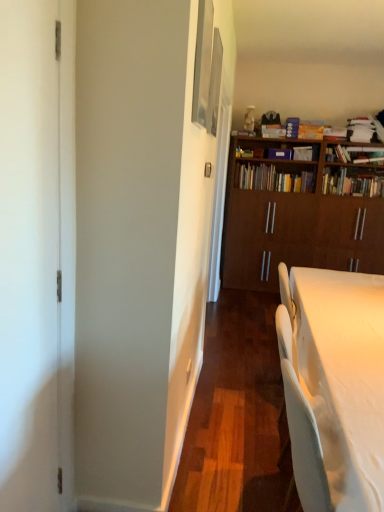
Question: Is white glossy desk at lower right oriented towards wooden bookshelf at upper right, the first book positioned from the right?

Choices:
 (A) yes
 (B) no

Answer: (B)

Question: Is white glossy desk at lower right behind wooden bookshelf at upper right, positioned as the 3th book in left-to-right order?

Choices:
 (A) yes
 (B) no

Answer: (B)

Question: Considering the relative positions of white glossy desk at lower right and wooden bookshelf at upper right, positioned as the 3th book in left-to-right order, in the image provided, is white glossy desk at lower right in front of wooden bookshelf at upper right, positioned as the 3th book in left-to-right order,?

Choices:
 (A) yes
 (B) no

Answer: (A)

Question: Considering the relative positions of white glossy desk at lower right and wooden bookshelf at upper right, the first book positioned from the right, in the image provided, is white glossy desk at lower right to the left of wooden bookshelf at upper right, the first book positioned from the right, from the viewer's perspective?

Choices:
 (A) no
 (B) yes

Answer: (B)

Question: Is wooden bookshelf at upper right, positioned as the 3th book in left-to-right order, located within white glossy desk at lower right?

Choices:
 (A) no
 (B) yes

Answer: (A)

Question: Is hardcover book at upper right, which is counted as the second book, starting from the left, spatially inside wooden bookshelf at center, the first book positioned from the left, or outside of it?

Choices:
 (A) outside
 (B) inside

Answer: (A)

Question: In terms of size, does hardcover book at upper right, which is counted as the second book, starting from the left, appear bigger or smaller than wooden bookshelf at center, the first book positioned from the left?

Choices:
 (A) big
 (B) small

Answer: (B)

Question: Is point (359, 161) closer or farther from the camera than point (276, 173)?

Choices:
 (A) farther
 (B) closer

Answer: (B)

Question: Considering the positions of hardcover book at upper right, which is counted as the second book, starting from the left, and wooden bookshelf at center, the third book in the right-to-left sequence, in the image, is hardcover book at upper right, which is counted as the second book, starting from the left, wider or thinner than wooden bookshelf at center, the third book in the right-to-left sequence,?

Choices:
 (A) thin
 (B) wide

Answer: (A)

Question: From the image's perspective, is metallic silver picture frame at upper center, acting as the 1th picture frame starting from the front, located above or below metallic silver picture frame at upper center, the 1th picture frame when ordered from back to front?

Choices:
 (A) above
 (B) below

Answer: (B)

Question: Which is correct: metallic silver picture frame at upper center, acting as the 1th picture frame starting from the front, is inside metallic silver picture frame at upper center, the 1th picture frame when ordered from back to front, or outside of it?

Choices:
 (A) inside
 (B) outside

Answer: (B)

Question: In terms of height, does metallic silver picture frame at upper center, acting as the 1th picture frame starting from the front, look taller or shorter compared to metallic silver picture frame at upper center, which is the 2th picture frame in front-to-back order?

Choices:
 (A) short
 (B) tall

Answer: (B)

Question: In the image, is metallic silver picture frame at upper center, acting as the 1th picture frame starting from the front, positioned in front of or behind metallic silver picture frame at upper center, which is the 2th picture frame in front-to-back order?

Choices:
 (A) front
 (B) behind

Answer: (A)

Question: Based on their sizes in the image, would you say wooden bookshelf at center, the third book in the right-to-left sequence, is bigger or smaller than wooden bookshelf at upper right, positioned as the 3th book in left-to-right order?

Choices:
 (A) big
 (B) small

Answer: (B)

Question: Relative to wooden bookshelf at upper right, the first book positioned from the right, is wooden bookshelf at center, the third book in the right-to-left sequence, in front or behind?

Choices:
 (A) front
 (B) behind

Answer: (B)